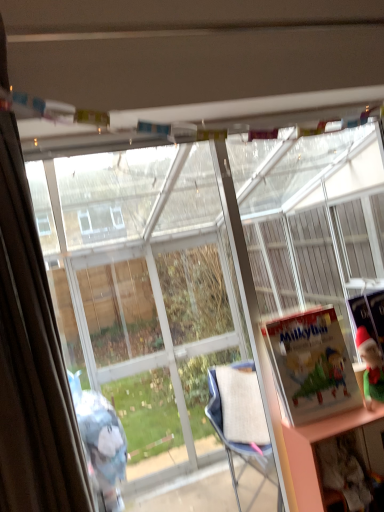
Question: From a real-world perspective, is matte green book at right, which is the second book in left-to-right order, located beneath transparent glass bay window at center?

Choices:
 (A) no
 (B) yes

Answer: (B)

Question: Does matte green book at right, which is the second book in left-to-right order, have a smaller size compared to transparent glass bay window at center?

Choices:
 (A) no
 (B) yes

Answer: (B)

Question: Considering the relative positions of matte green book at right, which appears as the first book when viewed from the back, and transparent glass bay window at center in the image provided, is matte green book at right, which appears as the first book when viewed from the back, behind transparent glass bay window at center?

Choices:
 (A) no
 (B) yes

Answer: (B)

Question: From the image's perspective, is matte green book at right, which appears as the 1th book when viewed from the right, on top of transparent glass bay window at center?

Choices:
 (A) yes
 (B) no

Answer: (B)

Question: Is matte green book at right, which appears as the 1th book when viewed from the right, aimed at transparent glass bay window at center?

Choices:
 (A) no
 (B) yes

Answer: (A)

Question: Looking at their shapes, would you say transparent glass bay window at center is wider or thinner than matte green book at right, which is counted as the 2th book, starting from the front?

Choices:
 (A) wide
 (B) thin

Answer: (A)

Question: Do you think transparent glass bay window at center is within matte green book at right, which is the second book in left-to-right order, or outside of it?

Choices:
 (A) outside
 (B) inside

Answer: (A)

Question: Considering the relative positions of transparent glass bay window at center and matte green book at right, which appears as the 1th book when viewed from the right, in the image provided, is transparent glass bay window at center to the left or to the right of matte green book at right, which appears as the 1th book when viewed from the right,?

Choices:
 (A) right
 (B) left

Answer: (B)

Question: Does point (148, 204) appear closer or farther from the camera than point (364, 306)?

Choices:
 (A) closer
 (B) farther

Answer: (B)

Question: Is matte green book at right, which appears as the first book when viewed from the back, in front of or behind brown fabric curtain at left in the image?

Choices:
 (A) behind
 (B) front

Answer: (A)

Question: Is matte green book at right, which is counted as the 2th book, starting from the front, taller or shorter than brown fabric curtain at left?

Choices:
 (A) short
 (B) tall

Answer: (A)

Question: Is matte green book at right, which is the second book in left-to-right order, inside the boundaries of brown fabric curtain at left, or outside?

Choices:
 (A) outside
 (B) inside

Answer: (A)

Question: Is matte green book at right, which is the second book in left-to-right order, bigger or smaller than brown fabric curtain at left?

Choices:
 (A) big
 (B) small

Answer: (B)

Question: Visually, is matte paper book at right, the 2th book positioned from the right, positioned to the left or to the right of matte green book at right, which is the second book in left-to-right order?

Choices:
 (A) left
 (B) right

Answer: (A)

Question: Is point (297, 312) closer or farther from the camera than point (372, 304)?

Choices:
 (A) closer
 (B) farther

Answer: (A)